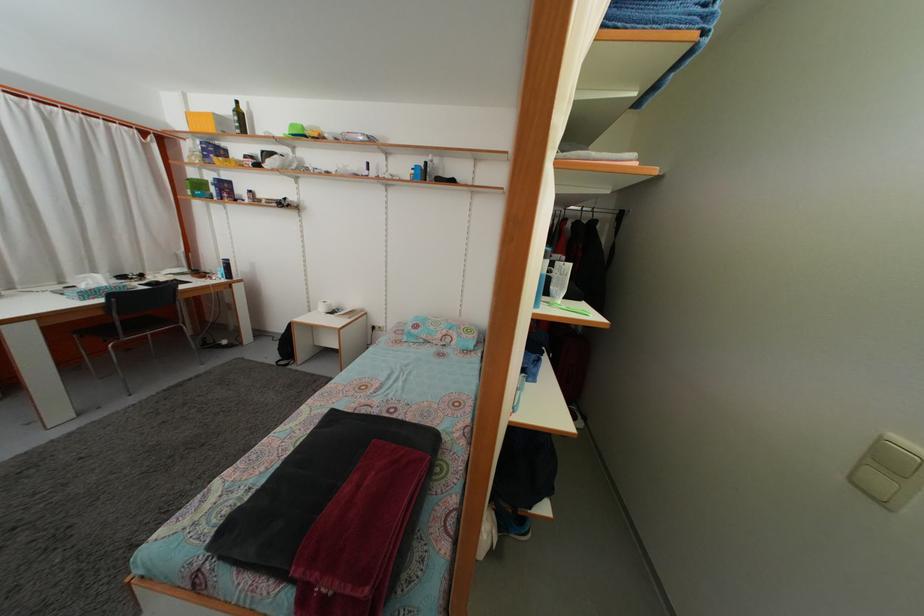
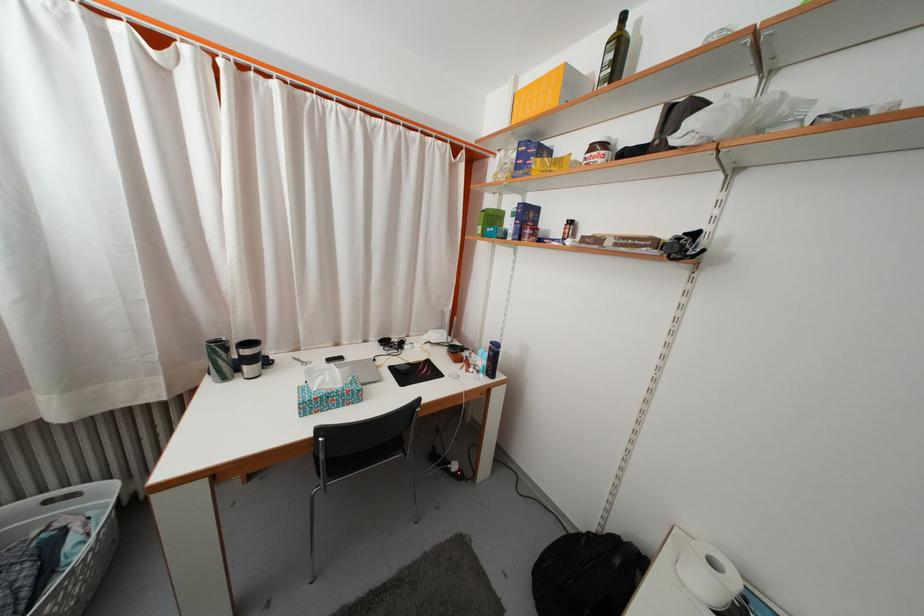
Where in the second image is the point corresponding to pixel 210 163 from the first image?

(523, 175)